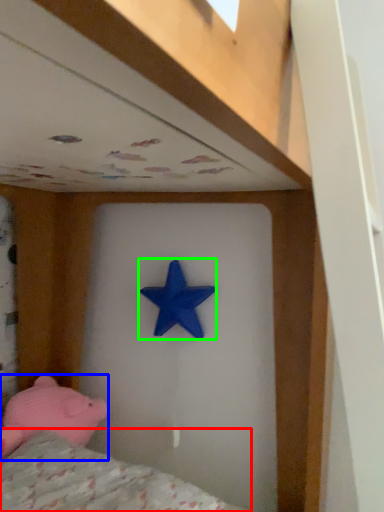
Question: Which is farther away from mattress (highlighted by a red box)? toy (highlighted by a blue box) or starfish (highlighted by a green box)?

Choices:
 (A) toy
 (B) starfish

Answer: (B)